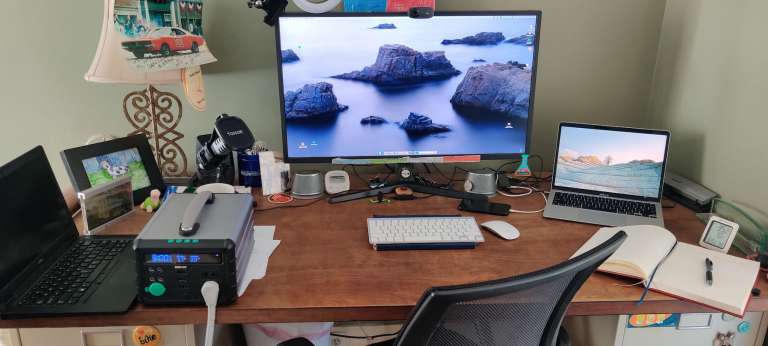
Where is `wireless apple keyboard`? The height and width of the screenshot is (346, 768). wireless apple keyboard is located at coordinates (421, 232).